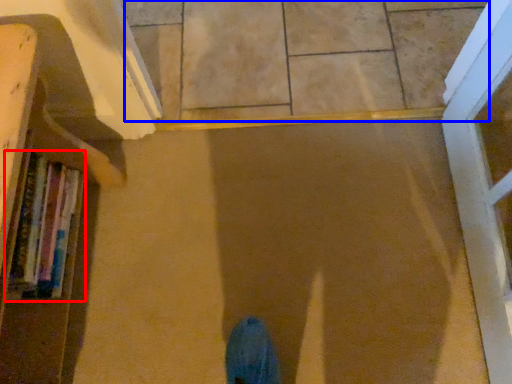
Question: Which object is closer to the camera taking this photo, book (highlighted by a red box) or tile (highlighted by a blue box)?

Choices:
 (A) book
 (B) tile

Answer: (A)